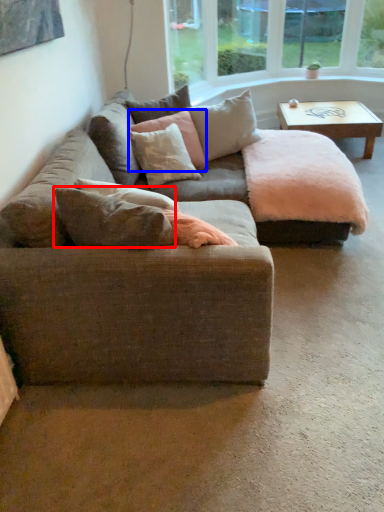
Question: Among these objects, which one is nearest to the camera, pillow (highlighted by a red box) or pillow (highlighted by a blue box)?

Choices:
 (A) pillow
 (B) pillow

Answer: (A)